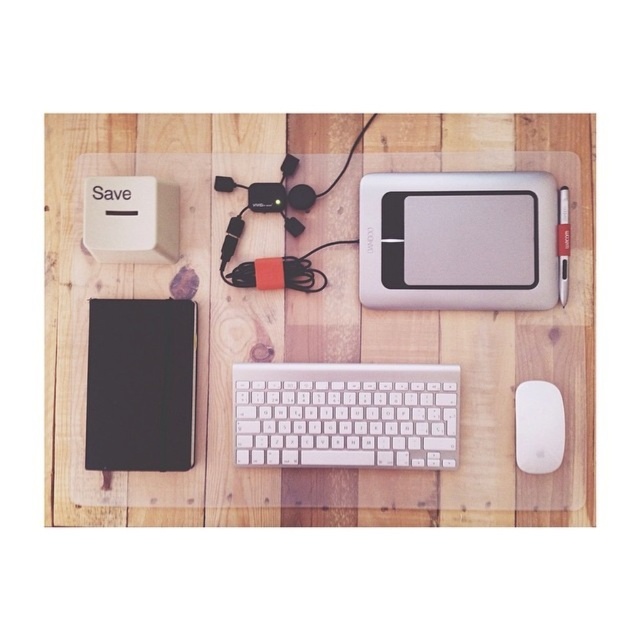
Question: Is silver metallic drawing tablet at center bigger than white plastic save button at upper left?

Choices:
 (A) yes
 (B) no

Answer: (A)

Question: Considering the relative positions of black matte tablet at lower left and white matte mouse at lower right in the image provided, where is black matte tablet at lower left located with respect to white matte mouse at lower right?

Choices:
 (A) left
 (B) right

Answer: (A)

Question: Does clear plastic table at center come in front of white matte mouse at lower right?

Choices:
 (A) yes
 (B) no

Answer: (B)

Question: Which object is closer to the camera taking this photo?

Choices:
 (A) white plastic keyboard at center
 (B) white plastic save button at upper left

Answer: (B)

Question: Estimate the real-world distances between objects in this image. Which object is closer to the white matte mouse at lower right?

Choices:
 (A) white plastic save button at upper left
 (B) clear plastic table at center
 (C) white plastic keyboard at center
 (D) silver metallic drawing tablet at center

Answer: (D)

Question: Which point appears farthest from the camera in this image?

Choices:
 (A) (560, 138)
 (B) (403, 198)
 (C) (140, 177)

Answer: (B)